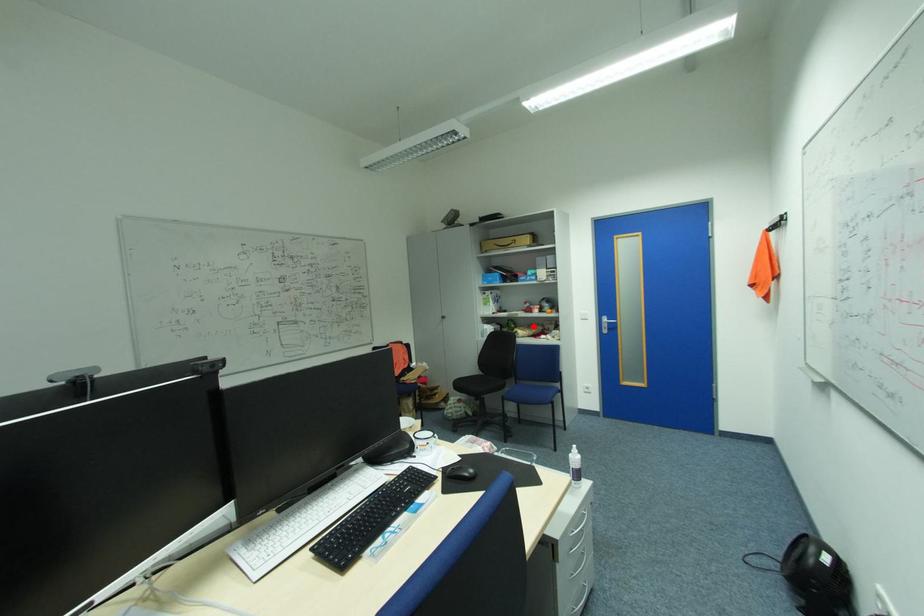
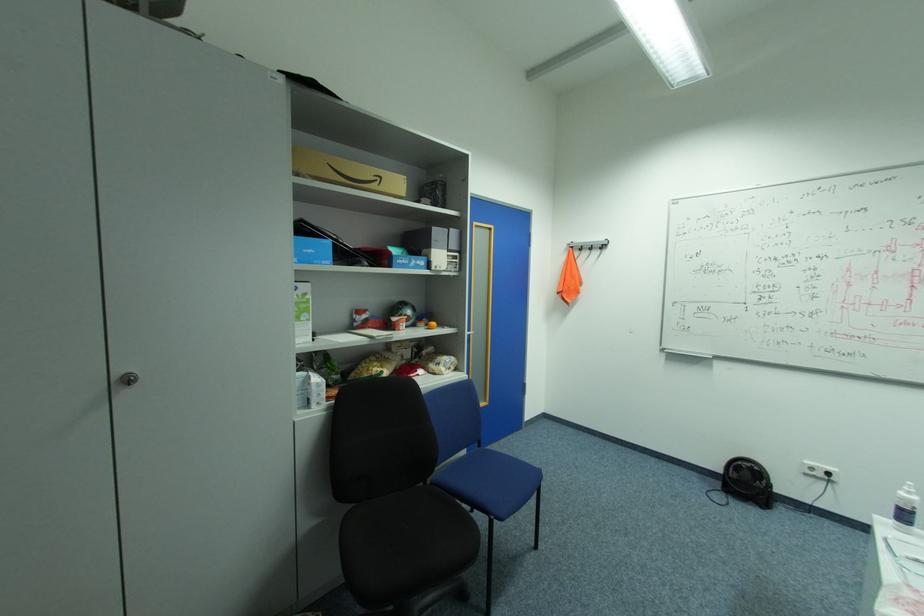
Find the pixel in the second image that matches the highlighted location in the first image.

(380, 358)